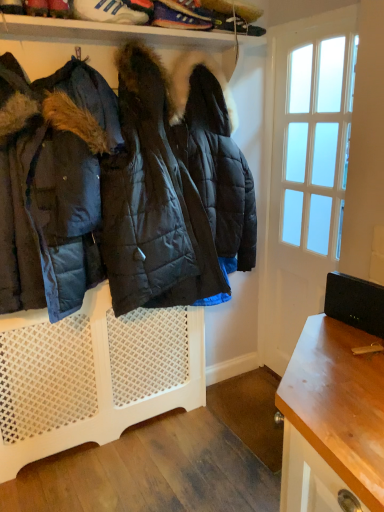
The image size is (384, 512). I want to click on vacant space to the right of white mesh radiator at center, so click(212, 437).